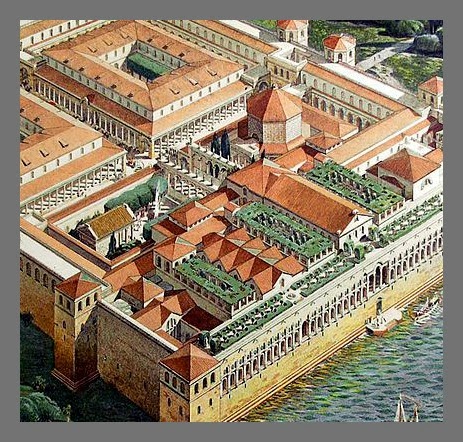
Where is `art work`? art work is located at coordinates (270, 279).